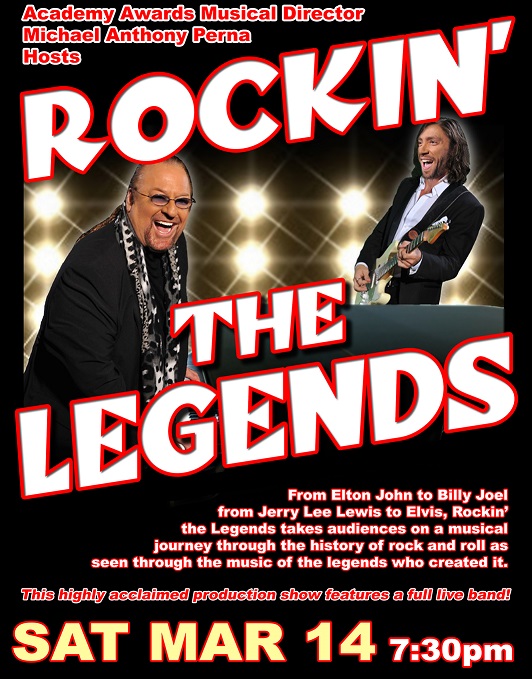
The image size is (532, 679). I want to click on lights, so [359, 206], [253, 263], [243, 200], [47, 204], [43, 257].